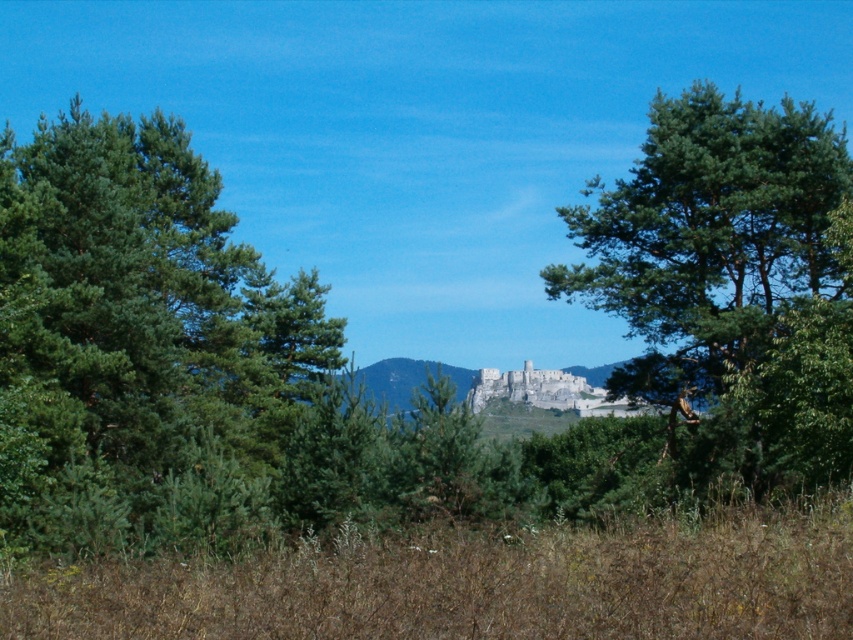
Question: Which of the following is the closest to the observer?

Choices:
 (A) green leafy tree at center
 (B) green matte tree at left

Answer: (B)

Question: Which point is farther to the camera?

Choices:
 (A) (160, 225)
 (B) (804, 356)

Answer: (A)

Question: Is green matte tree at left positioned in front of green leafy tree at center?

Choices:
 (A) no
 (B) yes

Answer: (B)

Question: Which point is farther to the camera?

Choices:
 (A) (62, 531)
 (B) (672, 99)

Answer: (B)

Question: Where is green matte tree at left located in relation to green leafy tree at center in the image?

Choices:
 (A) right
 (B) left

Answer: (B)

Question: Is green matte tree at left positioned before green leafy tree at center?

Choices:
 (A) no
 (B) yes

Answer: (B)